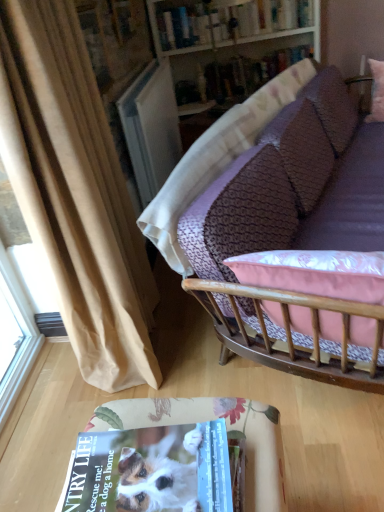
Question: Is beige fabric curtain at left outside wooden bookshelf at upper center?

Choices:
 (A) no
 (B) yes

Answer: (B)

Question: Are beige fabric curtain at left and wooden bookshelf at upper center beside each other?

Choices:
 (A) yes
 (B) no

Answer: (B)

Question: Can you confirm if beige fabric curtain at left is positioned to the right of wooden bookshelf at upper center?

Choices:
 (A) no
 (B) yes

Answer: (A)

Question: From a real-world perspective, is beige fabric curtain at left over wooden bookshelf at upper center?

Choices:
 (A) yes
 (B) no

Answer: (A)

Question: Can you confirm if beige fabric curtain at left is bigger than wooden bookshelf at upper center?

Choices:
 (A) no
 (B) yes

Answer: (A)

Question: Is beige fabric curtain at left far away from wooden bookshelf at upper center?

Choices:
 (A) yes
 (B) no

Answer: (A)

Question: From the image's perspective, is beige fabric curtain at left located beneath hardcover book at upper center, which is counted as the second book, starting from the top?

Choices:
 (A) no
 (B) yes

Answer: (B)

Question: From a real-world perspective, is beige fabric curtain at left physically below hardcover book at upper center, the 1th book from the bottom?

Choices:
 (A) no
 (B) yes

Answer: (A)

Question: Is beige fabric curtain at left shorter than hardcover book at upper center, the 1th book from the bottom?

Choices:
 (A) yes
 (B) no

Answer: (B)

Question: Does beige fabric curtain at left contain hardcover book at upper center, which is counted as the second book, starting from the top?

Choices:
 (A) no
 (B) yes

Answer: (A)

Question: Are beige fabric curtain at left and hardcover book at upper center, the 1th book from the bottom, beside each other?

Choices:
 (A) no
 (B) yes

Answer: (A)

Question: Is beige fabric curtain at left bigger than hardcover book at upper center, the 1th book from the bottom?

Choices:
 (A) yes
 (B) no

Answer: (A)

Question: Is beige fabric curtain at left oriented towards purple fabric couch at upper right?

Choices:
 (A) yes
 (B) no

Answer: (A)